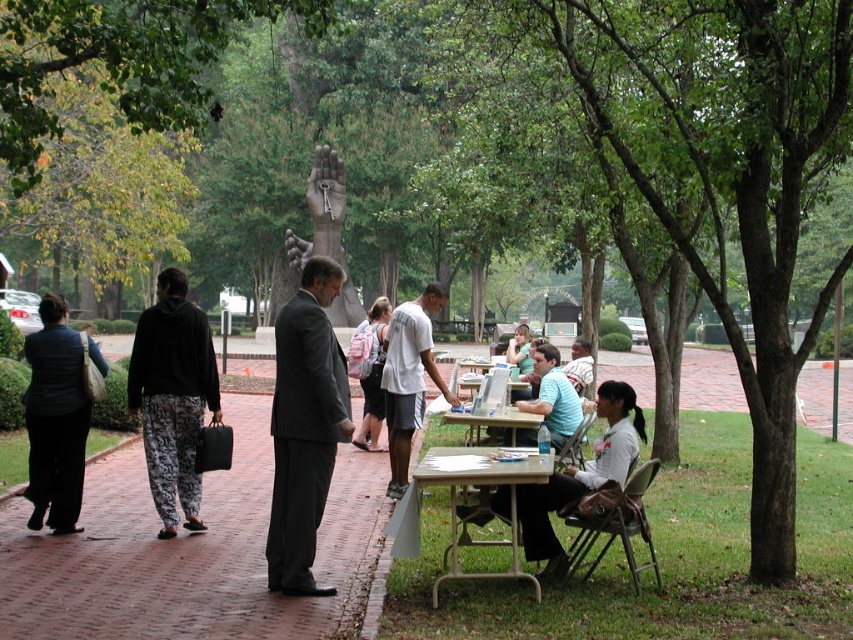
Who is taller, dark blue denim jacket at left or light gray fabric shirt at lower center?

dark blue denim jacket at left

Is point (28, 360) in front of point (630, 404)?

No, (28, 360) is further to viewer.

This screenshot has height=640, width=853. I want to click on dark blue denim jacket at left, so click(55, 419).

Is black cotton hoodie at left bigger than metallic silver table at lower center?

No.

Is black cotton hoodie at left taller than metallic silver table at lower center?

Incorrect, black cotton hoodie at left's height is not larger of metallic silver table at lower center's.

Where is `black cotton hoodie at left`? This screenshot has width=853, height=640. black cotton hoodie at left is located at coordinates pos(172,396).

Consider the image. Can you confirm if wooden table at center is smaller than light brown leather jacket at lower right?

Indeed, wooden table at center has a smaller size compared to light brown leather jacket at lower right.

Where is `wooden table at center`? This screenshot has width=853, height=640. wooden table at center is located at coordinates [x=494, y=422].

In the scene shown: Who is more distant from viewer, [497,429] or [590,381]?

The point [590,381] is more distant.

Identify the location of wooden table at center. This screenshot has height=640, width=853. pyautogui.click(x=494, y=422).